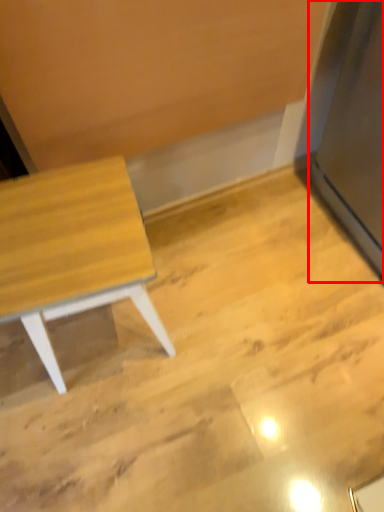
Question: From the image's perspective, what is the correct spatial positioning of fridge (annotated by the red box) in reference to table?

Choices:
 (A) below
 (B) above

Answer: (B)